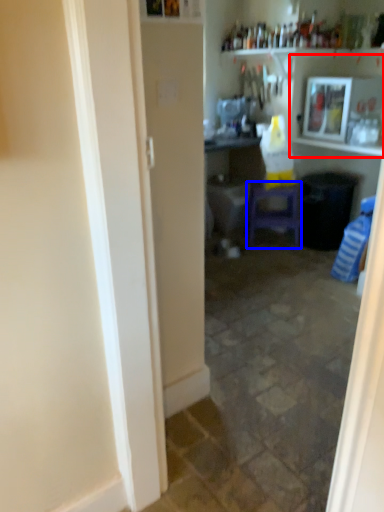
Question: Which object appears farthest to the camera in this image, shelf (highlighted by a red box) or furniture (highlighted by a blue box)?

Choices:
 (A) shelf
 (B) furniture

Answer: (B)